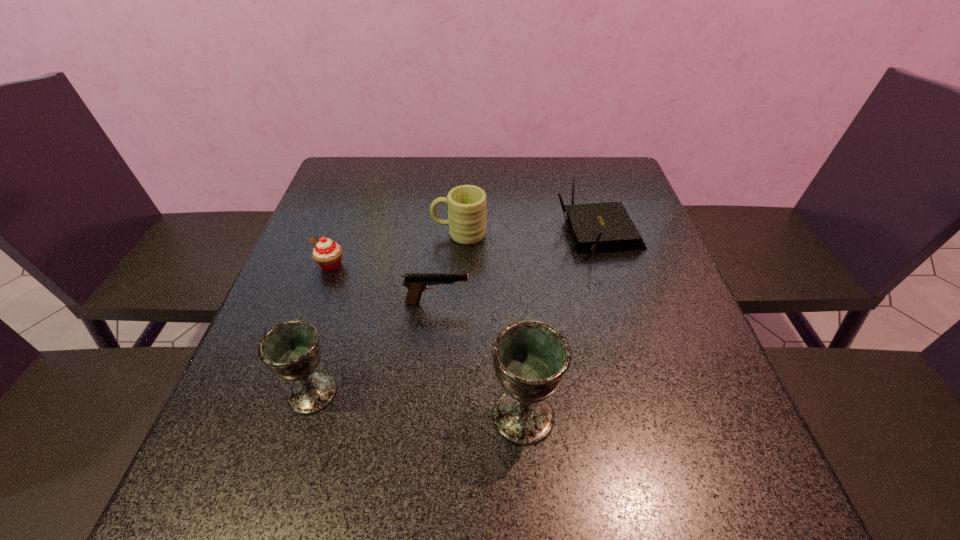
At what (x,y) coordinates should I click in order to perform the action: click on blank space located on the side of the third tallest object with the handle. Please return your answer as a coordinate pair (x, y). Looking at the image, I should click on (404, 233).

Where is `vacant space located on the side of the third tallest object with the handle`? vacant space located on the side of the third tallest object with the handle is located at coordinates (362, 233).

What are the coordinates of `free space located 0.210m on the side of the third tallest object with the handle` in the screenshot? It's located at pos(349,233).

Where is `free space located 0.140m at the muzzle of the third nearest object`? This screenshot has width=960, height=540. free space located 0.140m at the muzzle of the third nearest object is located at coordinates (534, 302).

At what (x,y) coordinates should I click in order to perform the action: click on vacant space situated 0.250m on the front of the router. Please return your answer as a coordinate pair (x, y). The image size is (960, 540). Looking at the image, I should click on (634, 348).

Where is `vacant region located on the front of the cupcake`? This screenshot has width=960, height=540. vacant region located on the front of the cupcake is located at coordinates (319, 300).

Where is `chalice that is at the left edge`? This screenshot has height=540, width=960. chalice that is at the left edge is located at coordinates click(291, 350).

Locate an element on the screen. The image size is (960, 540). cupcake present at the left edge is located at coordinates (327, 254).

This screenshot has width=960, height=540. Identify the location of object that is at the right edge. (599, 227).

I want to click on object present at the near left corner, so click(x=291, y=350).